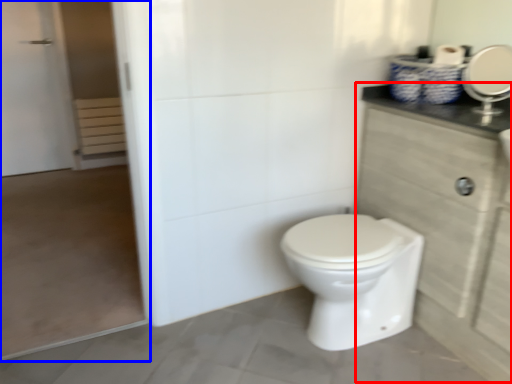
Question: Which object is closer to the camera taking this photo, dresser (highlighted by a red box) or screen door (highlighted by a blue box)?

Choices:
 (A) dresser
 (B) screen door

Answer: (A)